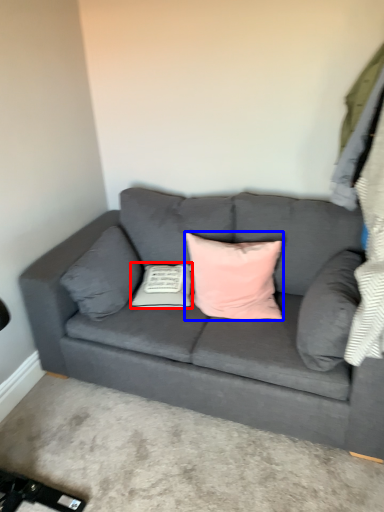
Question: Which point is further to the camera, pillow (highlighted by a red box) or pillow (highlighted by a blue box)?

Choices:
 (A) pillow
 (B) pillow

Answer: (A)